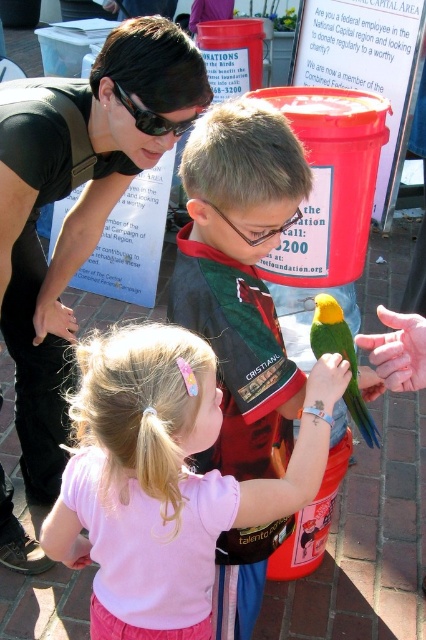
Who is more forward, (201, 150) or (321, 330)?

Point (201, 150) is in front.

Does green parrot at center appear under green matte parrot at center?

Correct, green parrot at center is located below green matte parrot at center.

This screenshot has height=640, width=426. Describe the element at coordinates (241, 278) in the screenshot. I see `green parrot at center` at that location.

Where is `green parrot at center`? green parrot at center is located at coordinates (241, 278).

Does pale pink fabric at center lie in front of matte black shirt at upper left?

Yes, pale pink fabric at center is in front of matte black shirt at upper left.

Image resolution: width=426 pixels, height=640 pixels. Describe the element at coordinates (166, 477) in the screenshot. I see `pale pink fabric at center` at that location.

The height and width of the screenshot is (640, 426). I want to click on pale pink fabric at center, so click(166, 477).

You are a GUI agent. You are given a task and a screenshot of the screen. Output one action in this format:
    pyautogui.click(x=<x>, y=<y>)
    Task: Click on the pale pink fabric at center
    
    Given the screenshot: What is the action you would take?
    tap(166, 477)

Who is lower down, pale pink fabric at center or black plastic goggles at upper center?

pale pink fabric at center is below.

Locate an element on the screen. The width and height of the screenshot is (426, 640). pale pink fabric at center is located at coordinates (166, 477).

I want to click on pale pink fabric at center, so click(166, 477).